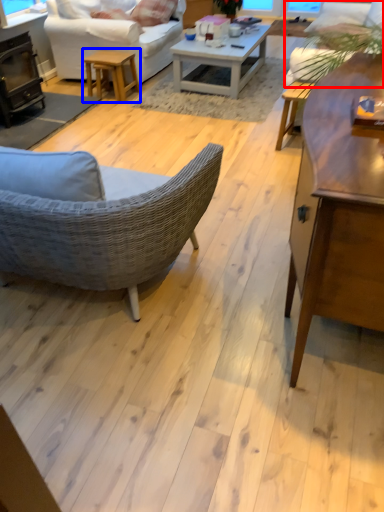
Question: Which object appears closest to the camera in this image, couch (highlighted by a red box) or table (highlighted by a blue box)?

Choices:
 (A) couch
 (B) table

Answer: (A)